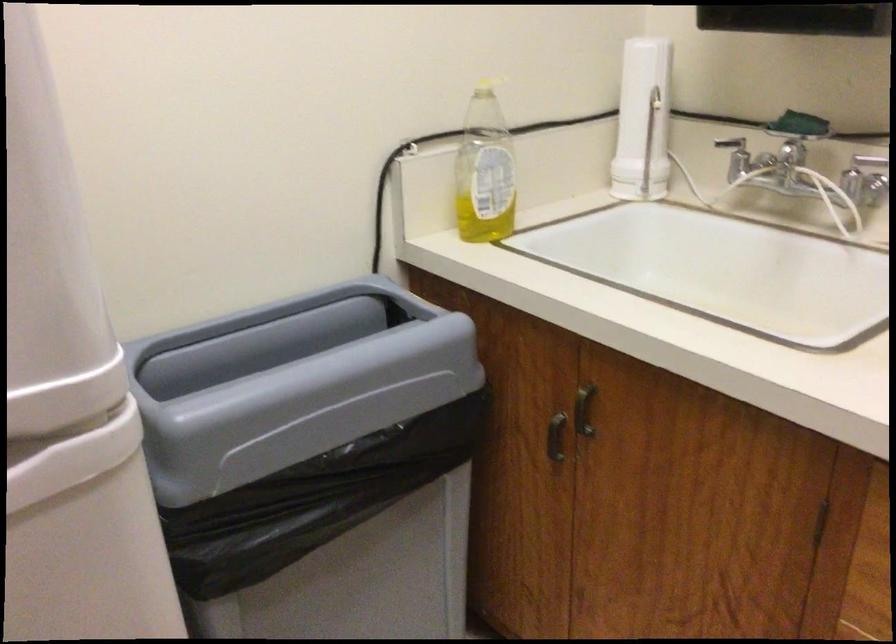
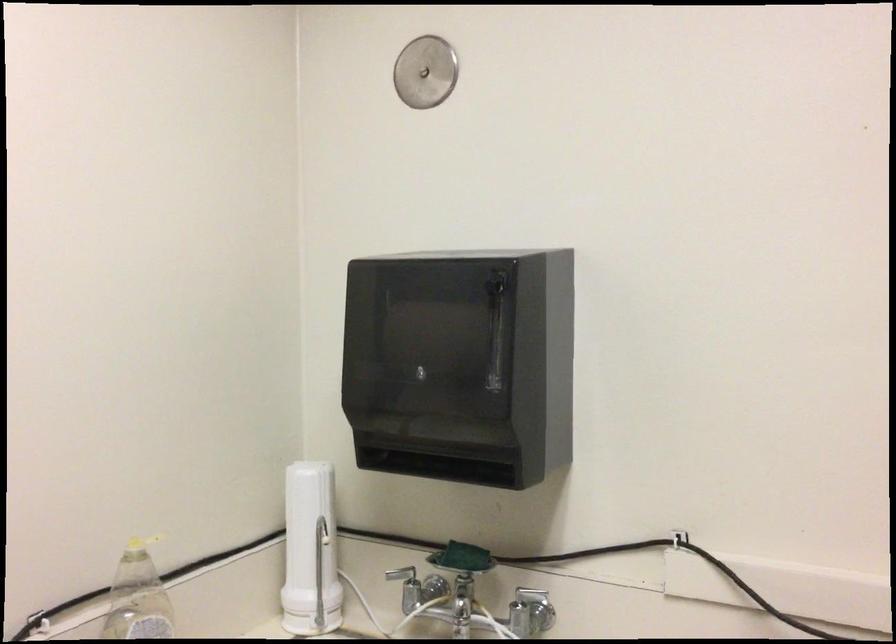
Locate, in the second image, the point that corresponds to (642,122) in the first image.

(309, 551)